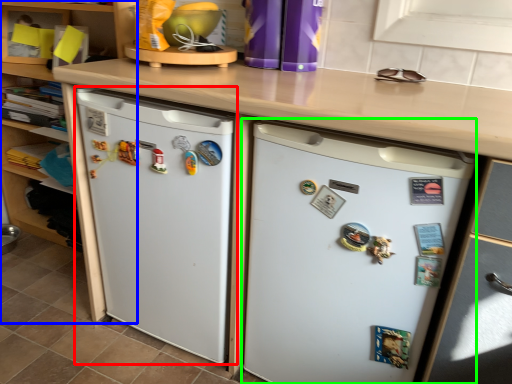
Question: Based on their relative distances, which object is nearer to refrigerator (highlighted by a red box)? Choose from cabinetry (highlighted by a blue box) and refrigerator (highlighted by a green box).

Choices:
 (A) cabinetry
 (B) refrigerator

Answer: (B)